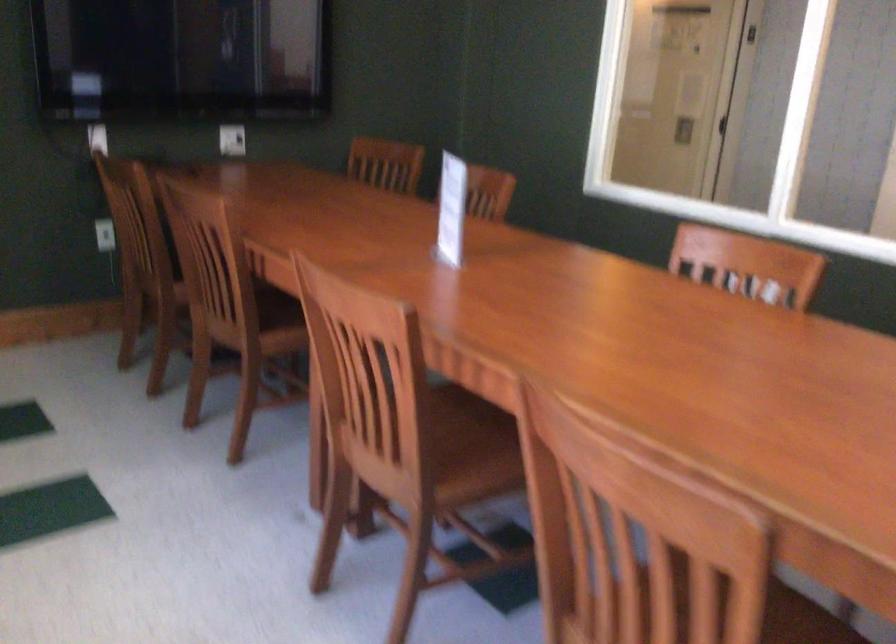
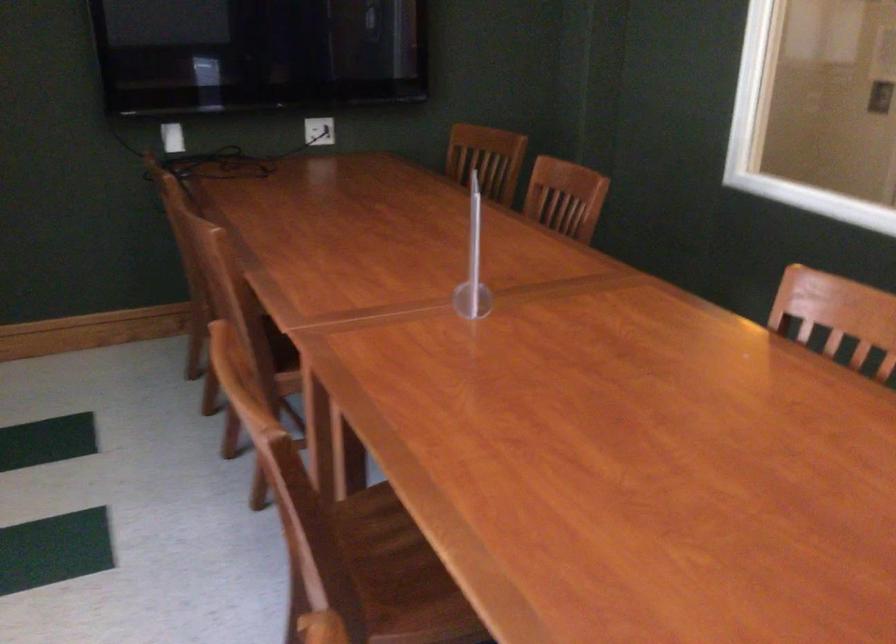
Locate, in the second image, the point that corresponds to point (727, 252) in the first image.

(841, 313)